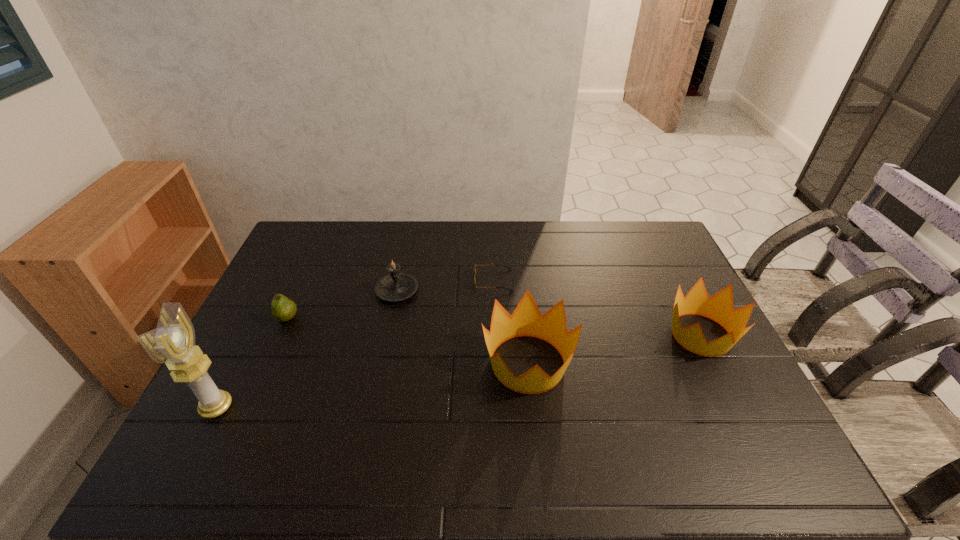
Find the location of a particular element. This screenshot has width=960, height=540. vacant region that satisfies the following two spatial constraints: 1. on the front side of the third object from left to right; 2. on the left side of the shorter crown is located at coordinates (388, 335).

The height and width of the screenshot is (540, 960). I want to click on blank space that satisfies the following two spatial constraints: 1. on the front-facing side of the left crown; 2. on the right side of the sunglasses, so click(496, 363).

I want to click on vacant area that satisfies the following two spatial constraints: 1. on the front side of the fifth shortest object; 2. on the right side of the fourth object from right to left, so (382, 363).